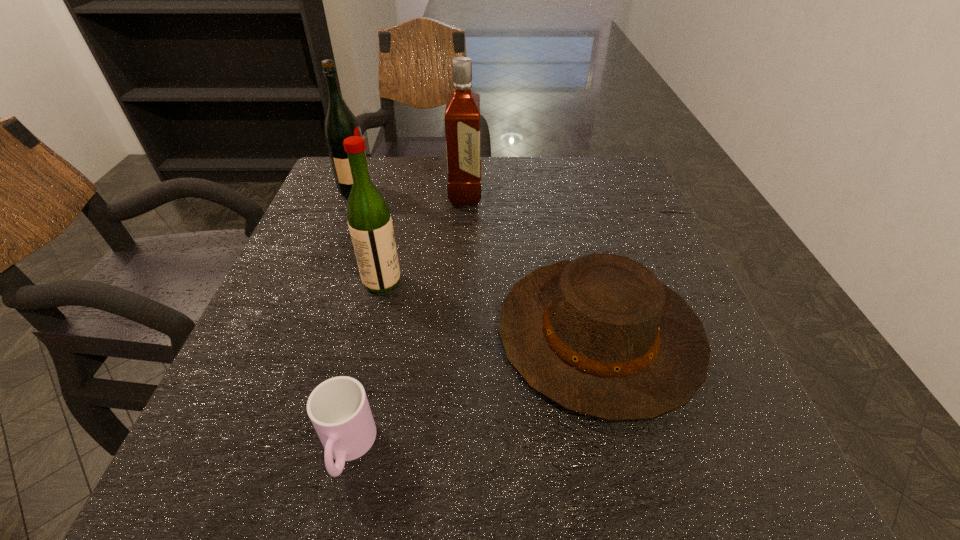
Identify which object is located as the fourth nearest to the rightmost liquor. Please provide its 2D coordinates. Your answer should be formatted as a tuple, i.e. [(x, y)], where the tuple contains the x and y coordinates of a point satisfying the conditions above.

[(338, 408)]

Find the location of `the third closest object to the second liquor from right to left`. the third closest object to the second liquor from right to left is located at coordinates (338, 408).

Identify the location of the second closest liquor to the rightmost liquor. This screenshot has width=960, height=540. (370, 224).

Choose which liquor is the second nearest neighbor to the nearest liquor. Please provide its 2D coordinates. Your answer should be formatted as a tuple, i.e. [(x, y)], where the tuple contains the x and y coordinates of a point satisfying the conditions above.

[(340, 123)]

The width and height of the screenshot is (960, 540). I want to click on free location that satisfies the following two spatial constraints: 1. on the label of the nearest liquor; 2. on the left side of the fourth tallest object, so click(370, 335).

You are a GUI agent. You are given a task and a screenshot of the screen. Output one action in this format:
    pyautogui.click(x=<x>, y=<y>)
    Task: Click on the vacant space that satisfies the following two spatial constraints: 1. on the front label of the rightmost liquor; 2. with the handle on the side of the cup
    
    Given the screenshot: What is the action you would take?
    pyautogui.click(x=454, y=449)

The image size is (960, 540). I want to click on vacant area that satisfies the following two spatial constraints: 1. on the front label of the rightmost liquor; 2. on the back side of the second shortest object, so click(459, 335).

Where is `free space that satisfies the following two spatial constraints: 1. on the front label of the rightmost object; 2. on the right side of the rightmost liquor`? This screenshot has width=960, height=540. free space that satisfies the following two spatial constraints: 1. on the front label of the rightmost object; 2. on the right side of the rightmost liquor is located at coordinates (459, 335).

Find the location of a particular element. The image size is (960, 540). free space that satisfies the following two spatial constraints: 1. on the front label of the second object from right to left; 2. on the right side of the rightmost object is located at coordinates click(x=459, y=335).

What are the coordinates of `free space that satisfies the following two spatial constraints: 1. on the label of the second liquor from left to right; 2. on the back side of the cowboy hat` in the screenshot? It's located at (370, 335).